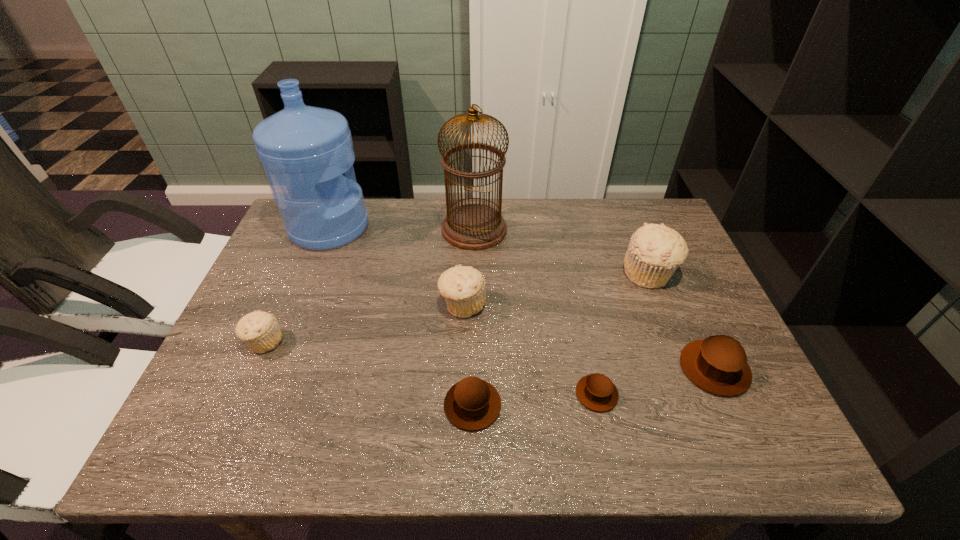
Locate an element on the screen. blue water jug is located at coordinates (304, 150).

Image resolution: width=960 pixels, height=540 pixels. In order to click on birdcage in this screenshot , I will do `click(472, 226)`.

The image size is (960, 540). What are the coordinates of `the rightmost beige muffin` in the screenshot? It's located at (655, 251).

Where is `the biggest beige muffin`? the biggest beige muffin is located at coordinates (655, 251).

You are a GUI agent. You are given a task and a screenshot of the screen. Output one action in this format:
    pyautogui.click(x=<x>, y=<y>)
    Task: Click on the second biggest beige muffin
    This screenshot has width=960, height=540.
    Given the screenshot: What is the action you would take?
    (x=463, y=287)

I want to click on the fifth shortest object, so click(x=463, y=287).

This screenshot has width=960, height=540. I want to click on the leftmost beige muffin, so click(259, 330).

Find the location of a particular element. The image size is (960, 540). the smallest beige muffin is located at coordinates (259, 330).

Find the location of a particular element. The height and width of the screenshot is (540, 960). the biggest brown muffin is located at coordinates (718, 364).

What are the coordinates of `the second smallest brown muffin` in the screenshot? It's located at (472, 404).